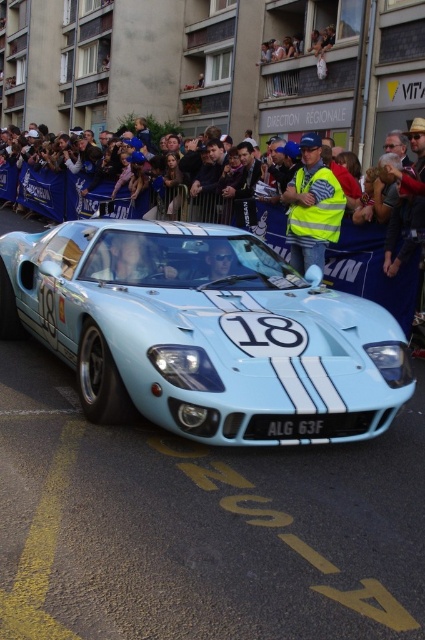
You are a photographer standing in front of the light blue metallic sports car at center and the black plastic license plate at center. You want to take a photo that includes both objects. Which object should you move closer to the camera to ensure the license plate is more prominent in the photo?

To make the black plastic license plate at center more prominent in the photo, you should move the light blue metallic sports car at center closer to the camera. Since the car is positioned on the left side of the license plate, moving it closer would allow the license plate to appear larger in the frame relative to the car.

You are a safety inspector at the event and need to ensure that the light blue metallic sports car at center and the yellow reflective vest at center are at least 3 meters apart for safety regulations. Based on the scene, are they compliant with the minimum distance requirement?

The light blue metallic sports car at center and the yellow reflective vest at center are 3.22 meters apart, which meets the minimum requirement of 3 meters. Therefore, they are compliant with the safety regulations.

You are a photographer standing at the starting line of the race, and you want to take a photo of the yellow reflective vest at center. Where should you aim your camera to capture the vest in the center of the image?

→ You should aim your camera at the coordinates point (312, 205) to capture the yellow reflective vest at center in the center of the image.